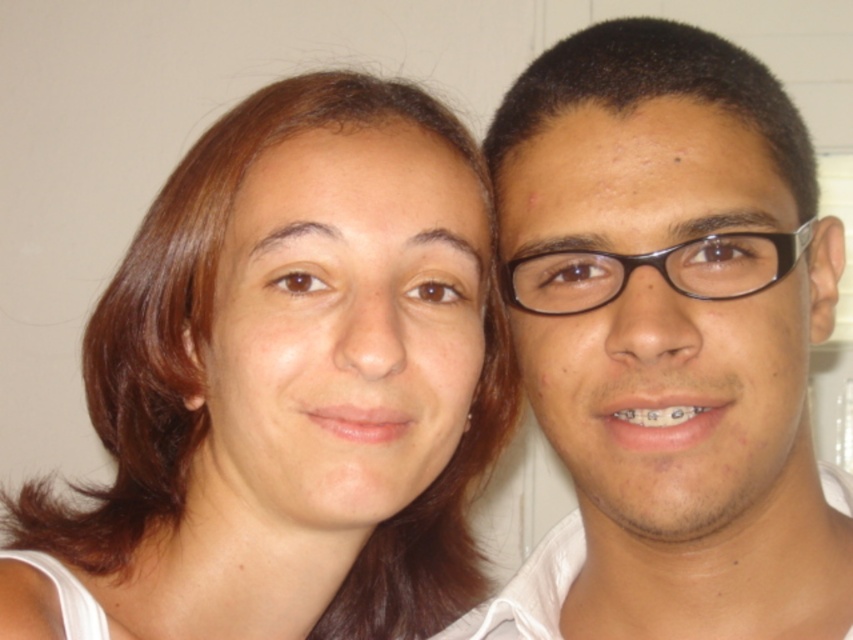
At what (x,y) coordinates should I click in order to perform the action: click on brown hair at center. Please return your answer as a coordinate pair (x, y). This screenshot has height=640, width=853. Looking at the image, I should click on (285, 387).

Does brown hair at center appear over matte black glasses at right?

Incorrect, brown hair at center is not positioned above matte black glasses at right.

Which is behind, point (248, 598) or point (753, 285)?

Positioned behind is point (248, 598).

Locate an element on the screen. Image resolution: width=853 pixels, height=640 pixels. brown hair at center is located at coordinates (285, 387).